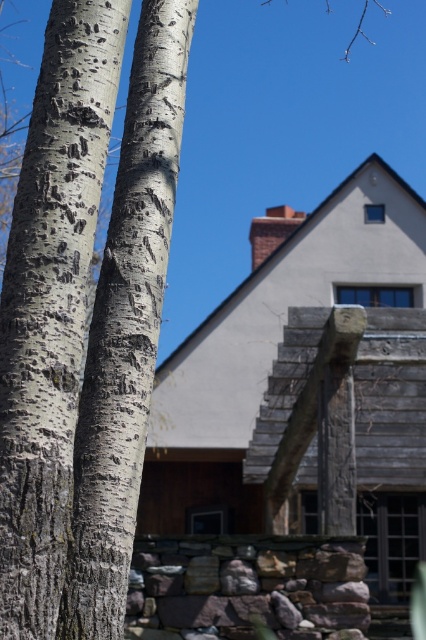
Can you confirm if white textured bark at left is smaller than white bark tree trunk at left?

Indeed, white textured bark at left has a smaller size compared to white bark tree trunk at left.

Which is more to the right, white textured bark at left or white bark tree trunk at left?

white bark tree trunk at left is more to the right.

Describe the element at coordinates (51, 304) in the screenshot. This screenshot has height=640, width=426. I see `white textured bark at left` at that location.

Find the location of a particular element. The height and width of the screenshot is (640, 426). white textured bark at left is located at coordinates (51, 304).